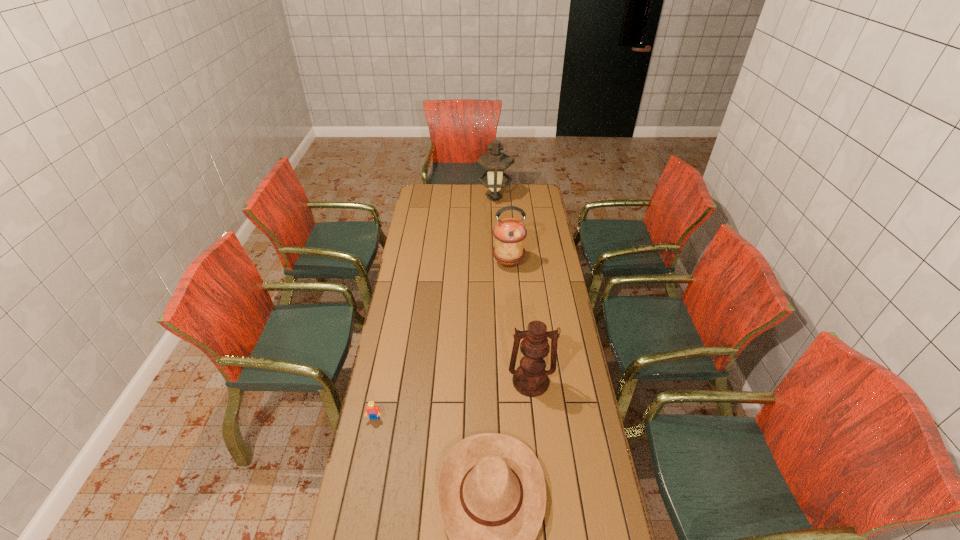
Choose which oil lamp is the nearest neighbor to the farthest object. Please provide its 2D coordinates. Your answer should be formatted as a tuple, i.e. [(x, y)], where the tuple contains the x and y coordinates of a point satisfying the conditions above.

[(509, 233)]